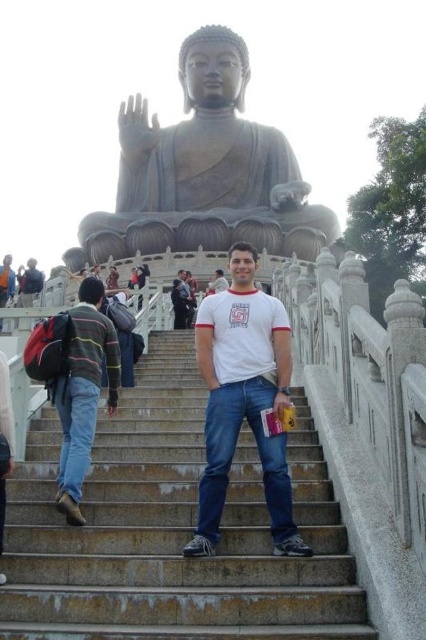
You are a tourist standing at the base of the Tian Tan Buddha statue and want to take a photo of the statue. However, there are people on the smooth stone stairs at center. Which direction should you move to avoid them and still have the matte gray statue at center in your view?

You should move to the left of the matte gray statue at center because the smooth stone stairs at center, where the people are standing, are to the right of the statue. By moving left, you can avoid the people on the stairs while keeping the statue in view.

You are standing at the base of the Tian Tan Buddha steps and want to take a photo of the dark gray stone statue at upper center. The smooth stone stairs at center are in your way. Can you move around to the side to avoid them?

The smooth stone stairs at center are closer to the viewer than the dark gray stone statue at upper center, so you can move to the side of the stairs to get a clear view of the statue.